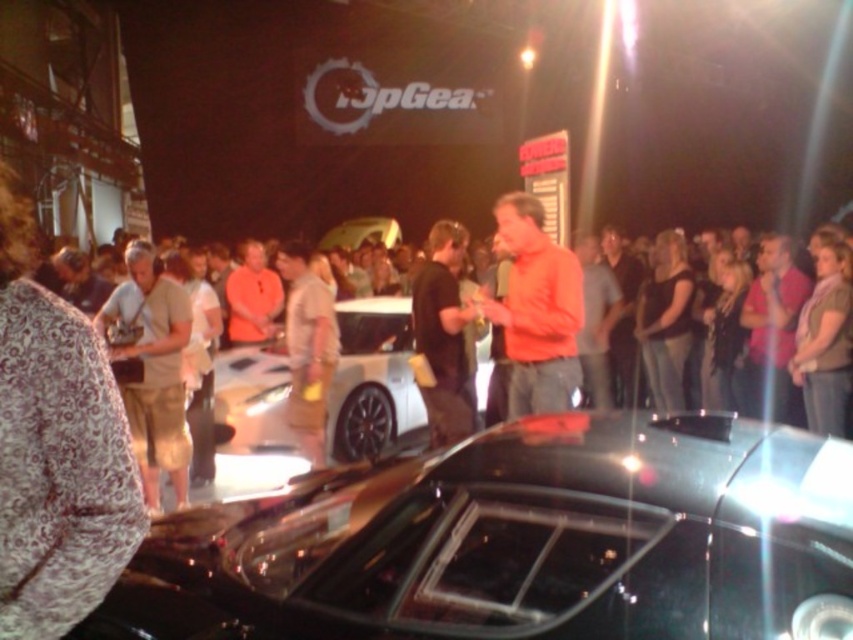
Does white metallic car at center lie in front of brown fabric shirt at right?

No, it is behind brown fabric shirt at right.

Is point (390, 365) positioned before point (827, 333)?

No, it is behind (827, 333).

The height and width of the screenshot is (640, 853). What are the coordinates of `white metallic car at center` in the screenshot? It's located at (372, 378).

Between point (328, 307) and point (668, 275), which one is positioned behind?

Point (668, 275)

Does khaki shorts at center appear on the left side of black fabric dress at center?

Indeed, khaki shorts at center is positioned on the left side of black fabric dress at center.

Between point (299, 384) and point (650, 330), which one is positioned in front?

Point (299, 384) is more forward.

Find the location of a particular element. khaki shorts at center is located at coordinates (306, 348).

Does shiny black car at center have a lesser height compared to tan fabric shirt at left?

Yes.

Is shiny black car at center to the left of tan fabric shirt at left from the viewer's perspective?

No, shiny black car at center is not to the left of tan fabric shirt at left.

Which is in front, point (637, 634) or point (175, 496)?

Point (637, 634)

The height and width of the screenshot is (640, 853). Find the location of `shiny black car at center`. shiny black car at center is located at coordinates (518, 541).